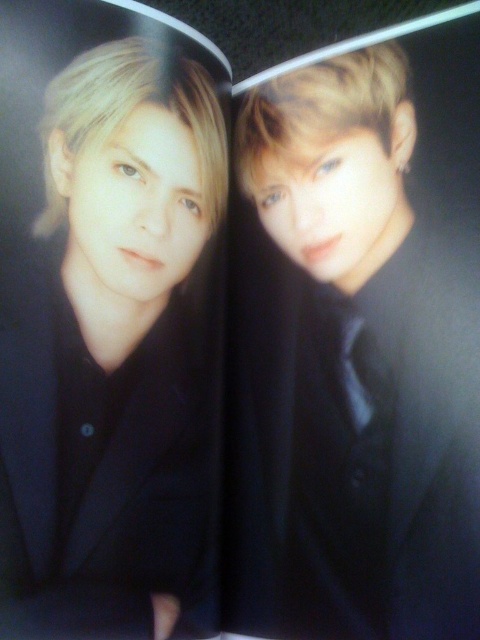
Question: Which point is farther from the camera taking this photo?

Choices:
 (A) (43, 394)
 (B) (358, 307)

Answer: (B)

Question: Is matte black jacket at left thinner than black satin business suit at center?

Choices:
 (A) no
 (B) yes

Answer: (B)

Question: Considering the relative positions of matte black jacket at left and black satin business suit at center in the image provided, where is matte black jacket at left located with respect to black satin business suit at center?

Choices:
 (A) right
 (B) left

Answer: (B)

Question: Which of the following is the closest to the observer?

Choices:
 (A) black satin business suit at center
 (B) matte black jacket at left

Answer: (B)

Question: In this image, where is matte black jacket at left located relative to black satin business suit at center?

Choices:
 (A) left
 (B) right

Answer: (A)